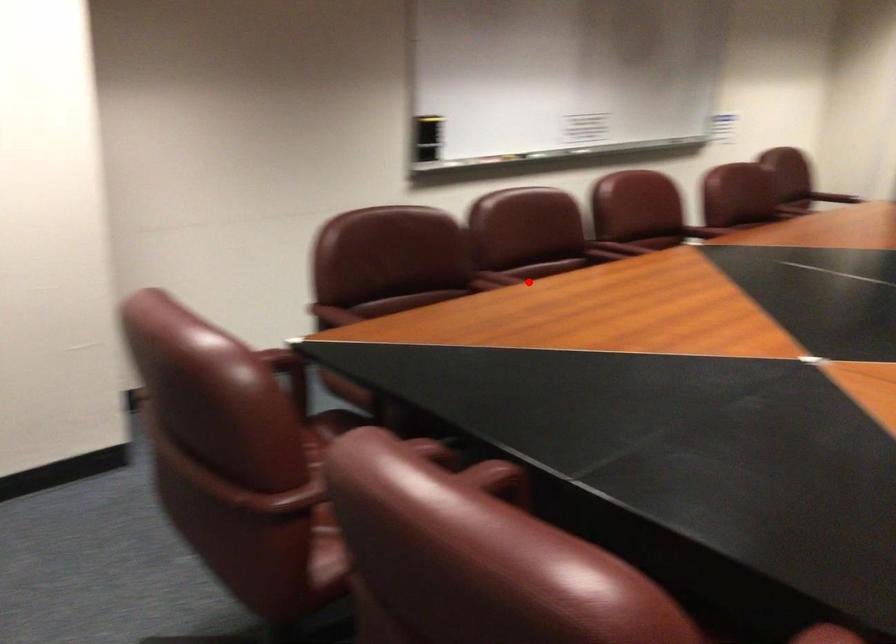
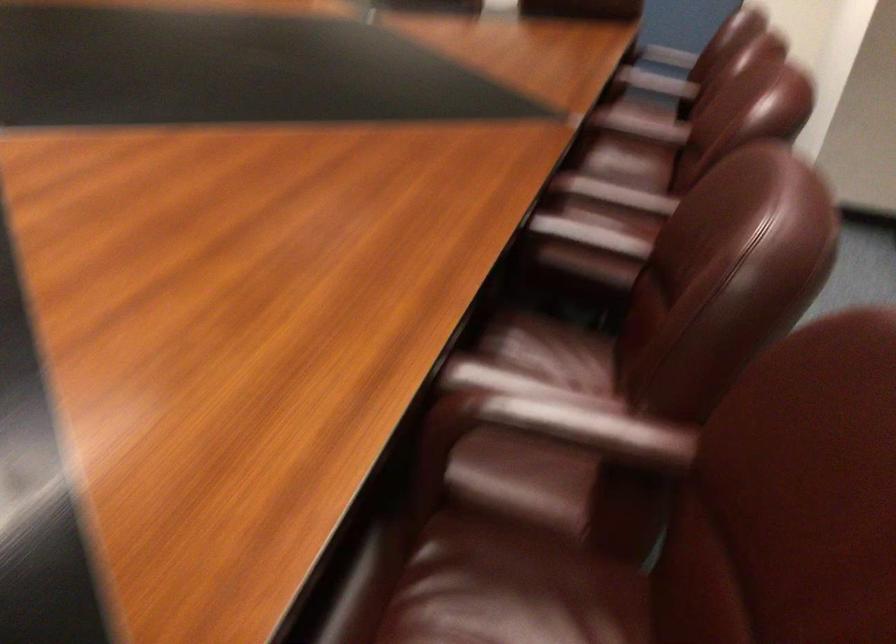
Find the pixel in the second image that matches the highlighted location in the first image.

(656, 82)